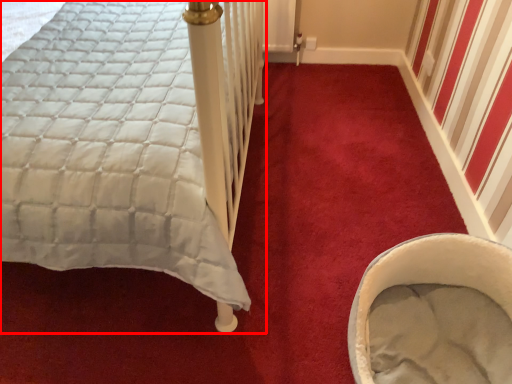
Question: From the image's perspective, considering the relative positions of bed (annotated by the red box) and baby carriage in the image provided, where is bed (annotated by the red box) located with respect to the staircase?

Choices:
 (A) below
 (B) above

Answer: (B)